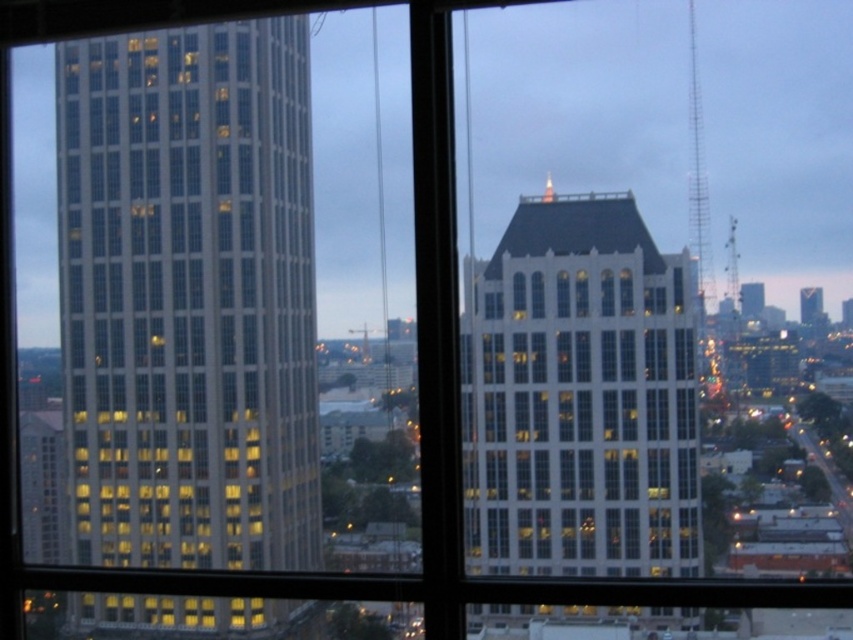
Can you confirm if transparent glass building at left is positioned to the left of white glass building at center?

Correct, you'll find transparent glass building at left to the left of white glass building at center.

Is transparent glass building at left taller than white glass building at center?

Correct, transparent glass building at left is much taller as white glass building at center.

Who is more forward, [276,225] or [486,561]?

Point [486,561]

The image size is (853, 640). I want to click on transparent glass building at left, so click(x=189, y=296).